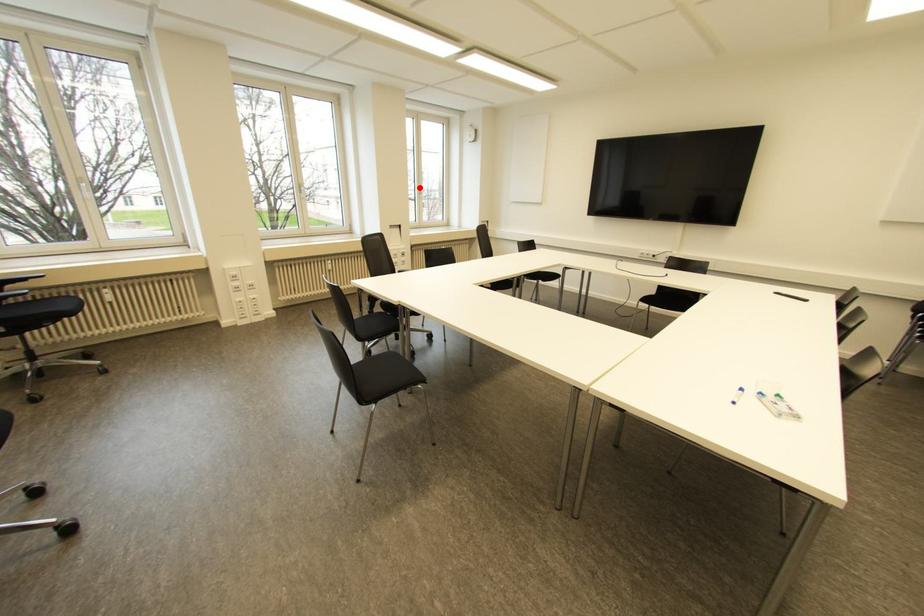
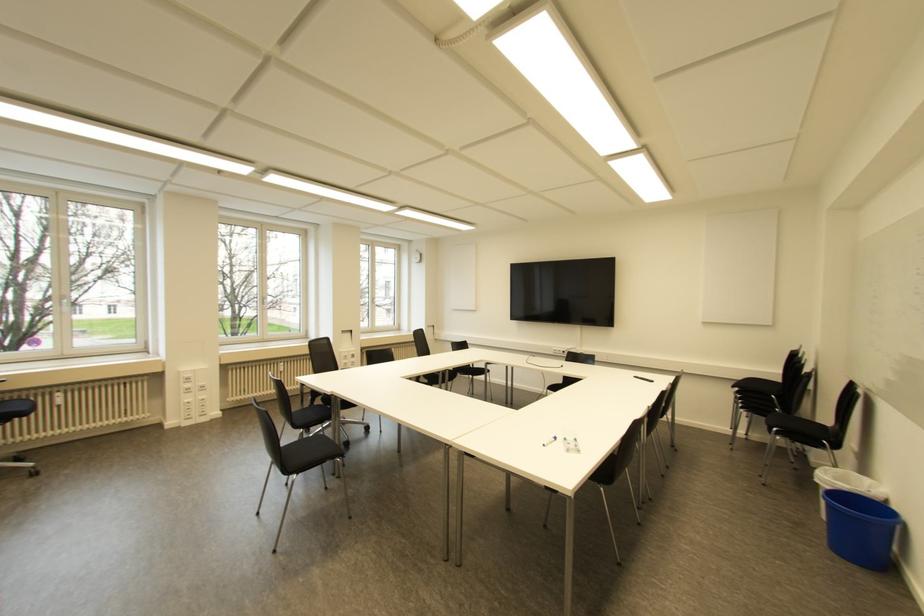
Question: I am providing you with two images of the same scene from different viewpoints. Given a red point in image1, look at the same physical point in image2. Is it:

Choices:
 (A) Closer to the viewpoint
 (B) Farther from the viewpoint

Answer: (B)